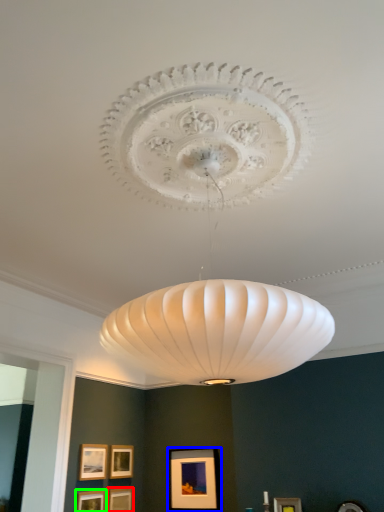
Question: Considering the real-world distances, which object is closest to picture frame (highlighted by a red box)? picture frame (highlighted by a blue box) or picture frame (highlighted by a green box).

Choices:
 (A) picture frame
 (B) picture frame

Answer: (B)